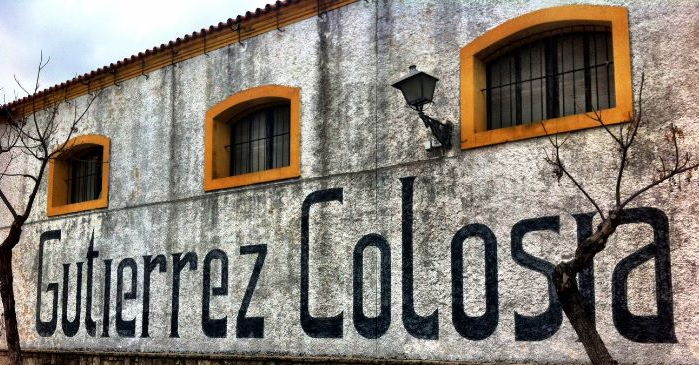
Locate an element on the screen. This screenshot has width=699, height=365. wall is located at coordinates (342, 145).